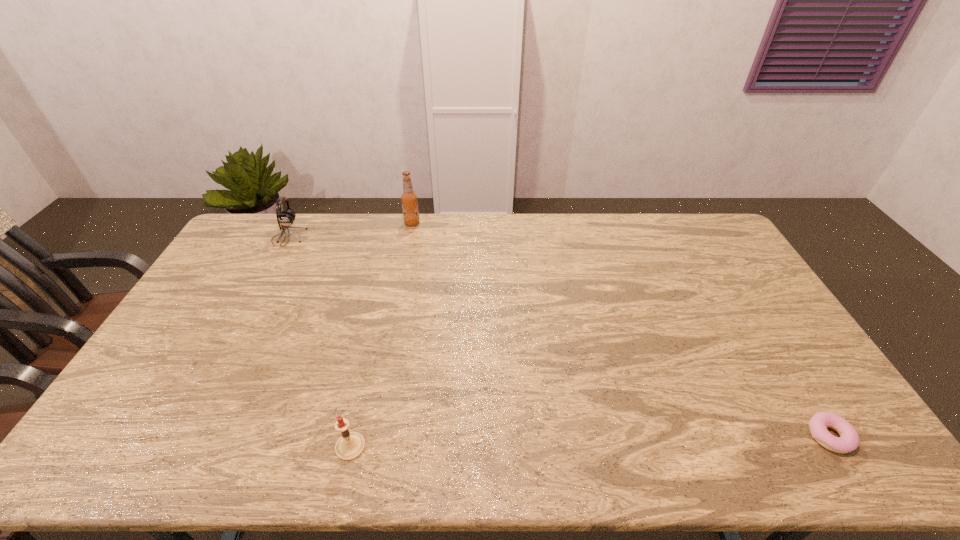
Where is `vacant space at the near edge`? The height and width of the screenshot is (540, 960). vacant space at the near edge is located at coordinates (227, 461).

Where is `blank space at the left edge of the desktop`? The image size is (960, 540). blank space at the left edge of the desktop is located at coordinates (204, 301).

Identify the location of vacant space at the right edge of the desktop. This screenshot has height=540, width=960. (745, 292).

You are a GUI agent. You are given a task and a screenshot of the screen. Output one action in this format:
    pyautogui.click(x=<x>, y=<y>)
    Task: Click on the vacant space at the far left corner of the desktop
    The image size is (960, 540).
    Given the screenshot: What is the action you would take?
    pyautogui.click(x=252, y=216)

You are a GUI agent. You are given a task and a screenshot of the screen. Output one action in this format:
    pyautogui.click(x=<x>, y=<y>)
    Task: Click on the free space at the near right corner
    This screenshot has height=540, width=960.
    Given the screenshot: What is the action you would take?
    coord(870,454)

Locate an element on the screen. The image size is (960, 540). vacant point located between the candle and the doughnut is located at coordinates (589, 441).

The image size is (960, 540). I want to click on unoccupied position between the candle and the leftmost object, so click(x=320, y=342).

Where is `vacant region between the rightmost object and the beer bottle`? vacant region between the rightmost object and the beer bottle is located at coordinates (620, 329).

Where is `vacant point located between the doughnut and the farthest object`? Image resolution: width=960 pixels, height=540 pixels. vacant point located between the doughnut and the farthest object is located at coordinates (620, 329).

Where is `vacant region between the leftmost object and the second shortest object`? vacant region between the leftmost object and the second shortest object is located at coordinates (320, 342).